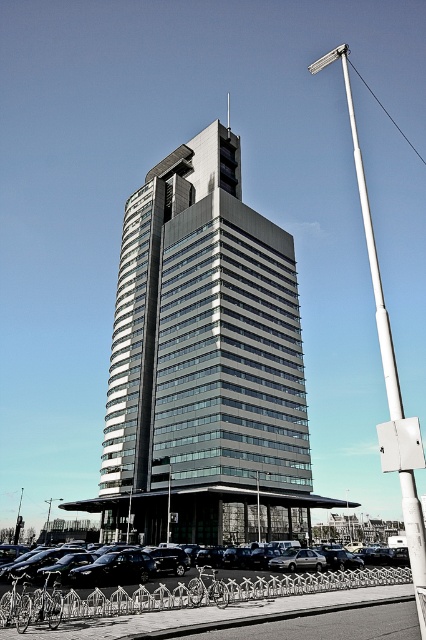
You are a delivery driver approaching the building and need to park your metallic silver car at center. The parking spot is located on the black asphalt parking lot at lower center. Can you safely drive your car onto the parking lot without any obstacles?

The black asphalt parking lot at lower center is in front of the metallic silver car at center, so yes, the driver can safely drive the metallic silver car at center onto the black asphalt parking lot at lower center as there are no obstacles blocking the path between them.

You are standing at the point marked by the coordinates point (311, 582) in the image. What is the surface material under your feet?

The point (311, 582) marks black asphalt parking lot at lower center, so the surface material under your feet is black asphalt parking lot at lower center.

You are standing in front of the modern building and want to locate two specific points marked on the facade. The first point is at coordinates point (258, 592) and the second is at point (34, 568). Which of these two points is positioned closer to your current viewpoint?

Point (258, 592) is closer to the viewer than point (34, 568).